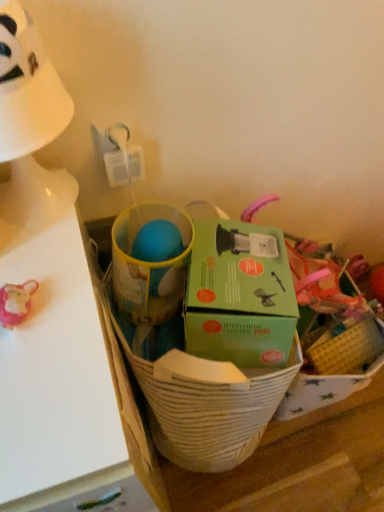
Question: Does white matte table at left lie in front of green cardboard box at center?

Choices:
 (A) yes
 (B) no

Answer: (A)

Question: Is white matte table at left at the left side of green cardboard box at center?

Choices:
 (A) no
 (B) yes

Answer: (B)

Question: From the image's perspective, is white matte table at left located beneath green cardboard box at center?

Choices:
 (A) no
 (B) yes

Answer: (B)

Question: Does white matte table at left turn towards green cardboard box at center?

Choices:
 (A) no
 (B) yes

Answer: (A)

Question: Can you confirm if white matte table at left is wider than green cardboard box at center?

Choices:
 (A) no
 (B) yes

Answer: (B)

Question: In terms of width, does white plastic table lamp at upper left look wider or thinner when compared to green cardboard box at center?

Choices:
 (A) thin
 (B) wide

Answer: (A)

Question: Is white plastic table lamp at upper left to the left or to the right of green cardboard box at center in the image?

Choices:
 (A) right
 (B) left

Answer: (B)

Question: Does point (39, 105) appear closer or farther from the camera than point (240, 272)?

Choices:
 (A) farther
 (B) closer

Answer: (B)

Question: Looking at the image, does white plastic table lamp at upper left seem bigger or smaller compared to green cardboard box at center?

Choices:
 (A) small
 (B) big

Answer: (A)

Question: Considering the positions of white plastic table lamp at upper left and white matte table at left in the image, is white plastic table lamp at upper left wider or thinner than white matte table at left?

Choices:
 (A) wide
 (B) thin

Answer: (B)

Question: From a real-world perspective, is white plastic table lamp at upper left above or below white matte table at left?

Choices:
 (A) below
 (B) above

Answer: (B)

Question: In the image, is white plastic table lamp at upper left positioned in front of or behind white matte table at left?

Choices:
 (A) behind
 (B) front

Answer: (A)

Question: Considering the positions of white plastic table lamp at upper left and white matte table at left in the image, is white plastic table lamp at upper left taller or shorter than white matte table at left?

Choices:
 (A) tall
 (B) short

Answer: (B)

Question: Is green cardboard box at center to the left or to the right of white plastic table lamp at upper left in the image?

Choices:
 (A) right
 (B) left

Answer: (A)

Question: In terms of size, does green cardboard box at center appear bigger or smaller than white plastic table lamp at upper left?

Choices:
 (A) small
 (B) big

Answer: (B)